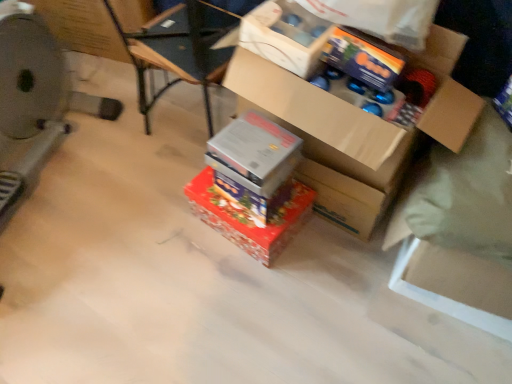
Find the location of a particular element. This screenshot has height=384, width=512. free spot in front of shiny metallic box at center, the first box in the bottom-to-top sequence is located at coordinates (251, 292).